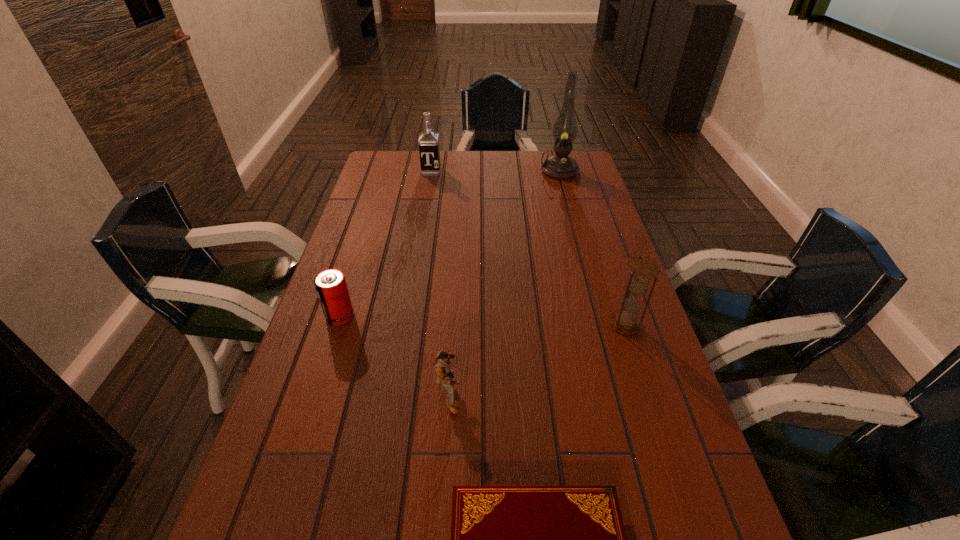
The image size is (960, 540). What are the coordinates of `the tallest object` in the screenshot? It's located at (560, 166).

Find the location of a particular element. The width and height of the screenshot is (960, 540). the second object from left to right is located at coordinates (428, 141).

This screenshot has height=540, width=960. Find the location of `hourglass`. hourglass is located at coordinates (642, 268).

This screenshot has height=540, width=960. Find the location of `can`. can is located at coordinates (330, 284).

Identify the location of puncher. (441, 364).

Locate an element on the screen. Image resolution: width=960 pixels, height=540 pixels. free space located 0.110m on the front of the tallest object is located at coordinates (566, 196).

Find the location of a particular element. free spot located 0.100m on the front label of the fifth object from right to left is located at coordinates (428, 190).

This screenshot has height=540, width=960. I want to click on vacant area situated on the back of the hourglass, so click(607, 265).

Where is `vacant space located 0.050m on the back of the leftmost object`? vacant space located 0.050m on the back of the leftmost object is located at coordinates (348, 293).

This screenshot has width=960, height=540. Find the location of `blank area located on the front-facing side of the puncher`. blank area located on the front-facing side of the puncher is located at coordinates (553, 394).